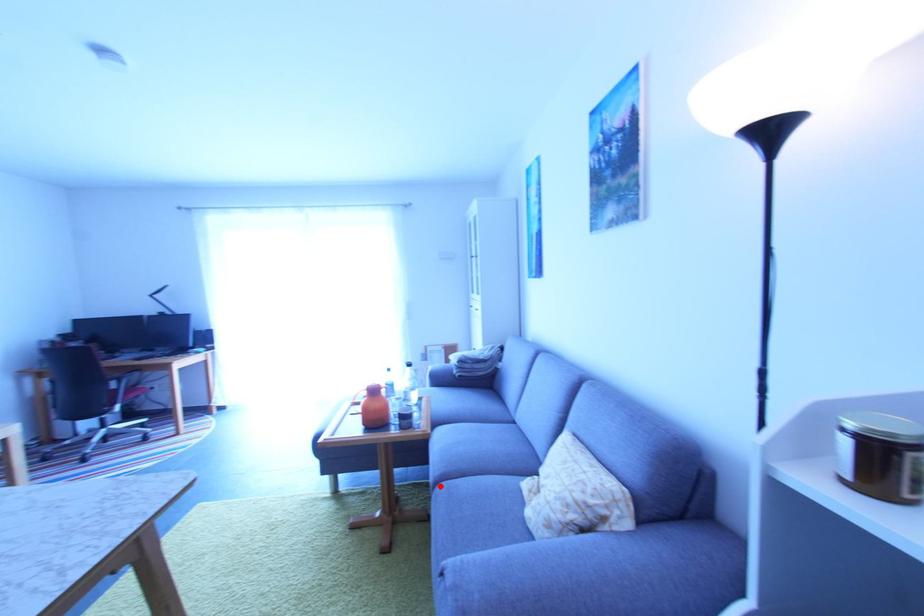
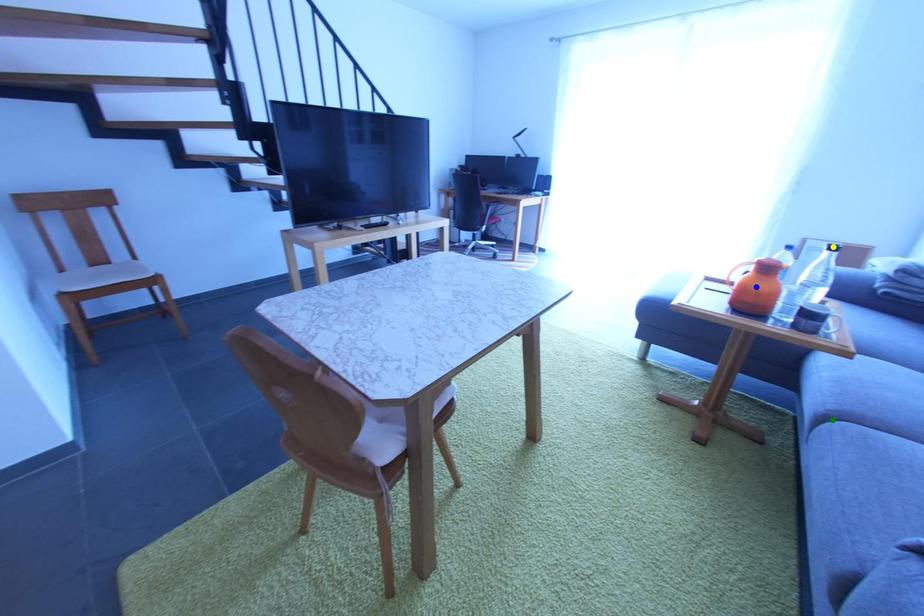
Question: I am providing you with two images of the same scene from different viewpoints. A red point is marked on the first image. You are given multiple points on the second image. In image 2, which mark is for the same physical point as the one in image 1?

Choices:
 (A) blue point
 (B) yellow point
 (C) green point

Answer: (C)